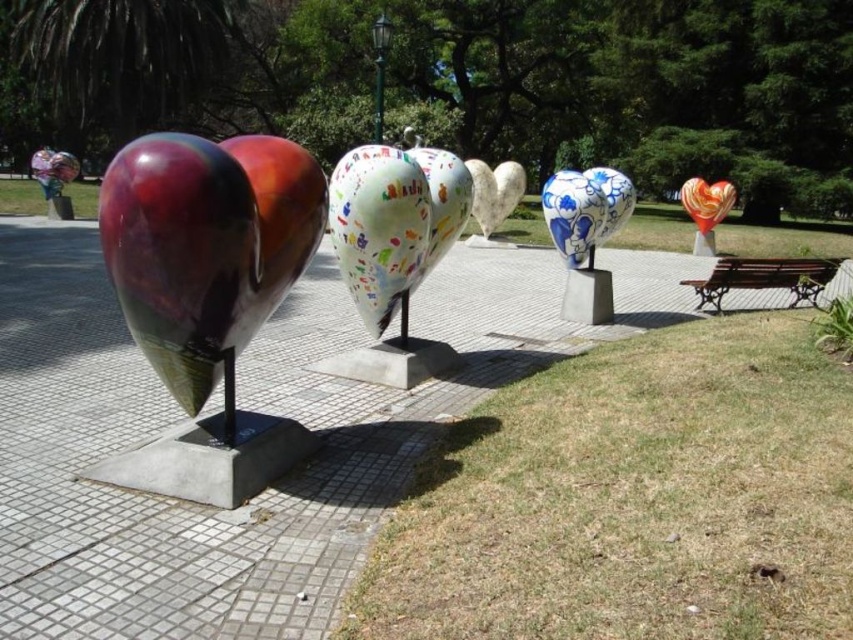
You are a visitor at the park and want to sit on the brown wrought iron bench at lower right while still being able to see the multicolored glossy heart at upper right. Is the bench positioned in a way that allows you to view the heart without obstruction?

The brown wrought iron bench at lower right is located below the multicolored glossy heart at upper right, so sitting on the bench would allow you to see the heart as it is positioned above the bench.

You are a park visitor who wants to sit on the brown wrought iron bench at lower right while also getting a clear view of the multicolored glossy heart at upper right. Is the bench large enough to accommodate you and still allow you to see the heart without obstruction?

The brown wrought iron bench at lower right is larger in size than the multicolored glossy heart at upper right. Since the bench is larger, it should provide sufficient space for you to sit comfortably while still having an unobstructed view of the heart sculpture.

You are standing on the walkway and want to sit down. Which object, the glossy metallic balloon at left or the brown wrought iron bench at lower right, is closer to you?

The glossy metallic balloon at left is closer to the viewer than the brown wrought iron bench at lower right, so the bench is farther away. The brown wrought iron bench at lower right is the one you can sit on and it is farther away from you compared to the balloon.